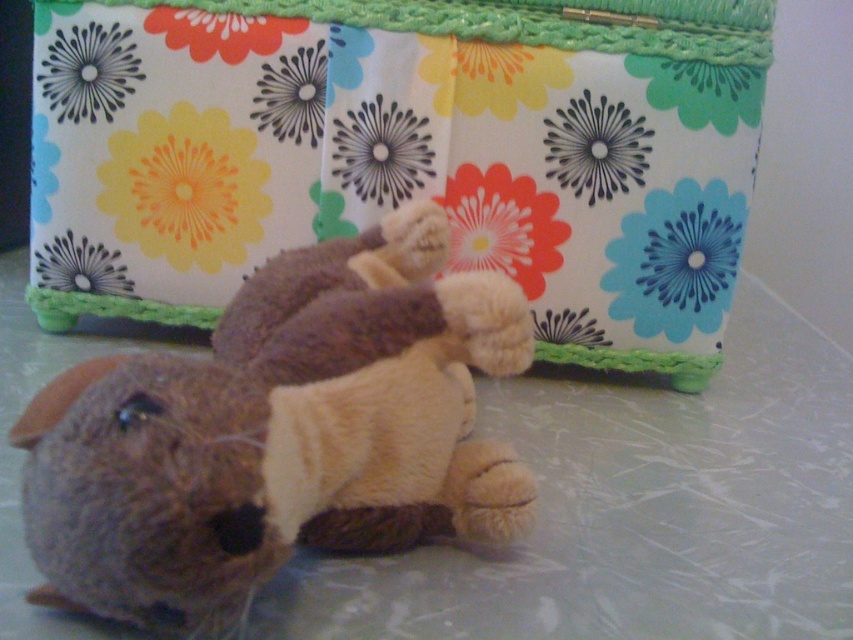
Which is behind, point (409, 0) or point (86, 609)?

The point (409, 0) is more distant.

Is floral fabric box at upper center closer to camera compared to fuzzy brown stuffed animal at lower left?

No, floral fabric box at upper center is further to the viewer.

Who is more forward, (143, 316) or (140, 609)?

Point (140, 609) is in front.

Locate an element on the screen. The height and width of the screenshot is (640, 853). floral fabric box at upper center is located at coordinates (405, 154).